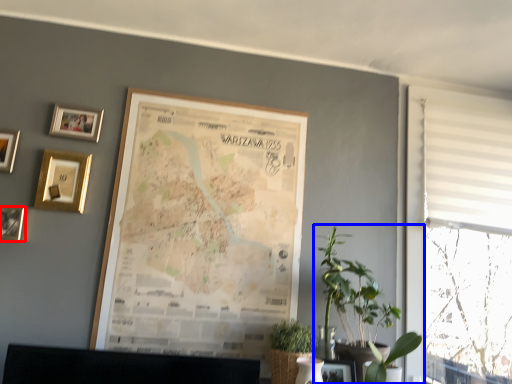
Question: Which of the following is the closest to the observer, picture frame (highlighted by a red box) or houseplant (highlighted by a blue box)?

Choices:
 (A) picture frame
 (B) houseplant

Answer: (B)